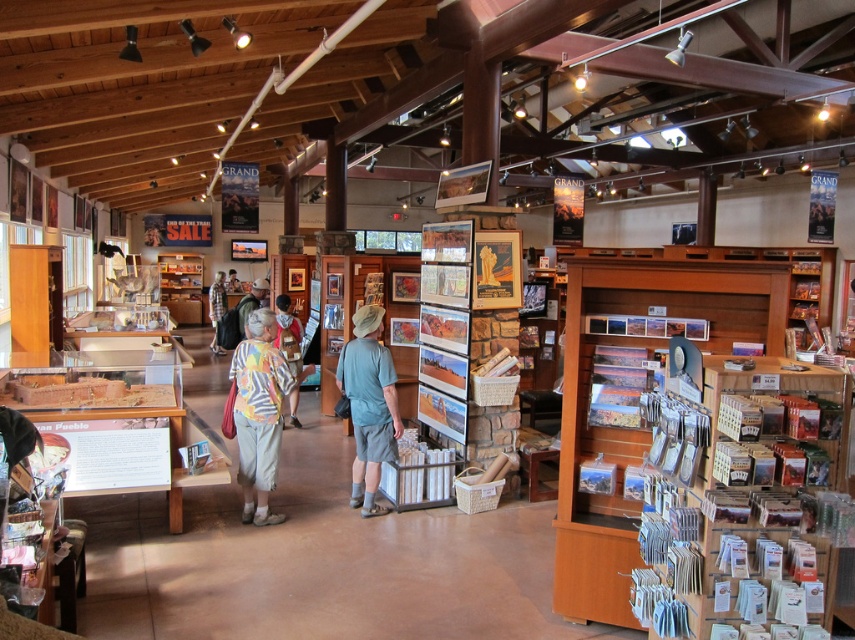
You are a customer in the gift shop and you want to pick up both the light blue fabric shirt at center and the camouflage jacket at center. Can you reach both items without moving from your current position?

The distance between the light blue fabric shirt at center and the camouflage jacket at center is 5.94 meters. Since this distance is quite large, you would need to move to reach both items from your current position.

You are a customer in the gift shop and want to buy a shirt. You see both the printed fabric shirt at center and the plaid shirt at center. Which shirt is taller?

The printed fabric shirt at center is taller than the plaid shirt at center.